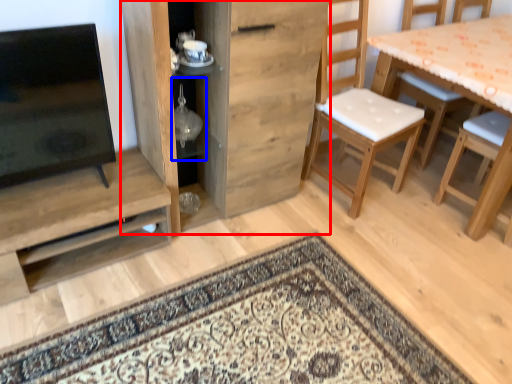
Question: Which of the following is the closest to the observer, cabinetry (highlighted by a red box) or shelf (highlighted by a blue box)?

Choices:
 (A) cabinetry
 (B) shelf

Answer: (A)